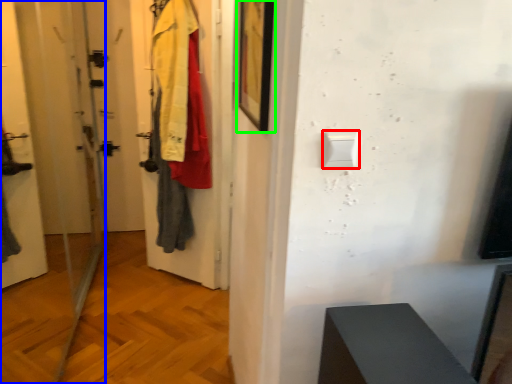
Question: Estimate the real-world distances between objects in this image. Which object is farther from light switch (highlighted by a red box), screen door (highlighted by a blue box) or picture frame (highlighted by a green box)?

Choices:
 (A) screen door
 (B) picture frame

Answer: (A)